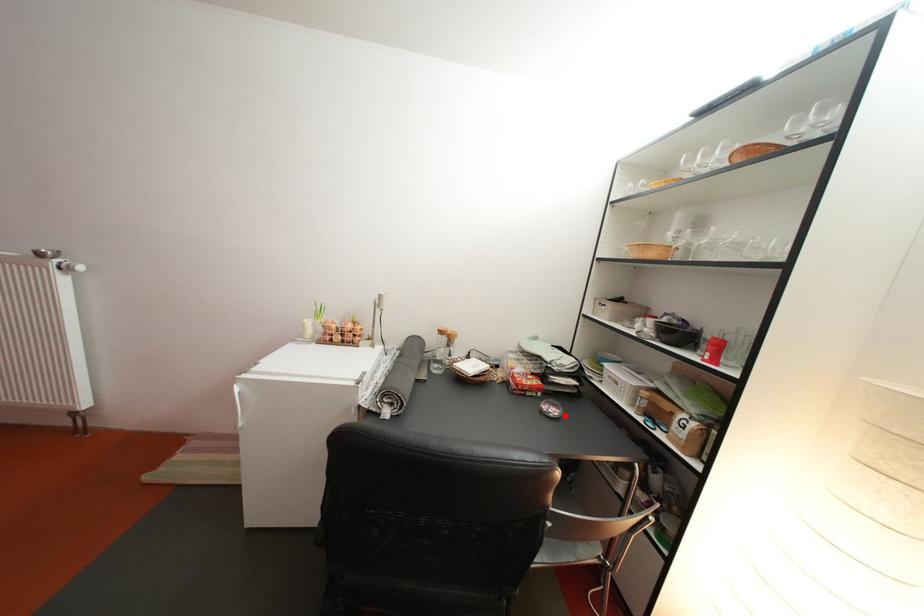
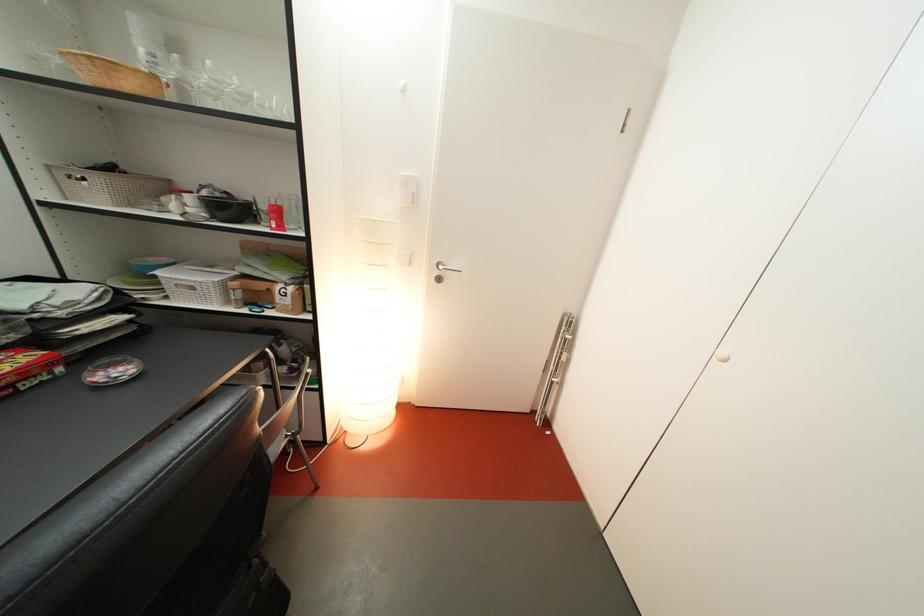
Locate, in the second image, the point that corresponds to the highlighted location in the first image.

(131, 376)